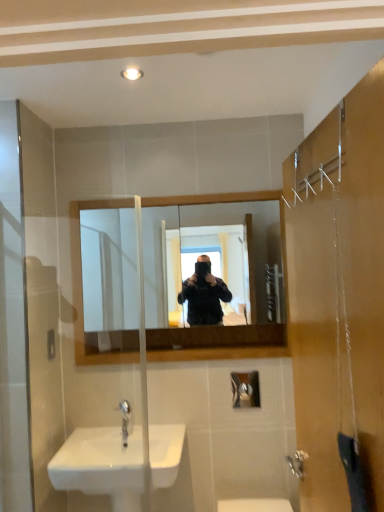
Question: Visually, is white glossy light fixture at upper center positioned to the left or to the right of wooden frame mirror at center?

Choices:
 (A) left
 (B) right

Answer: (A)

Question: Relative to wooden frame mirror at center, is white glossy light fixture at upper center in front or behind?

Choices:
 (A) behind
 (B) front

Answer: (B)

Question: Which object is the closest to the white glossy light fixture at upper center?

Choices:
 (A) wooden frame mirror at center
 (B) silver metallic faucet at lower center
 (C) white glossy sink at lower left

Answer: (A)

Question: Estimate the real-world distances between objects in this image. Which object is farther from the white glossy light fixture at upper center?

Choices:
 (A) white glossy sink at lower left
 (B) silver metallic faucet at lower center
 (C) wooden frame mirror at center

Answer: (A)